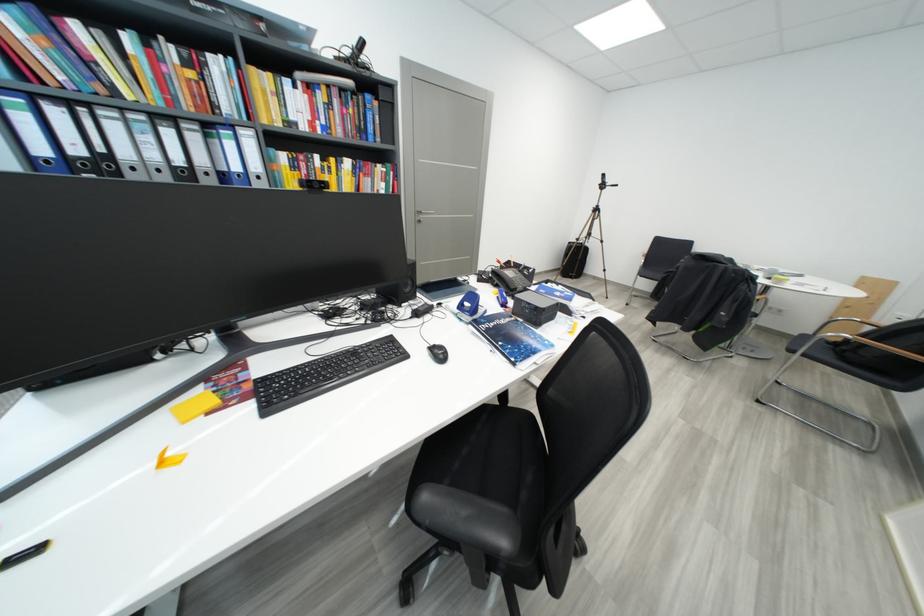
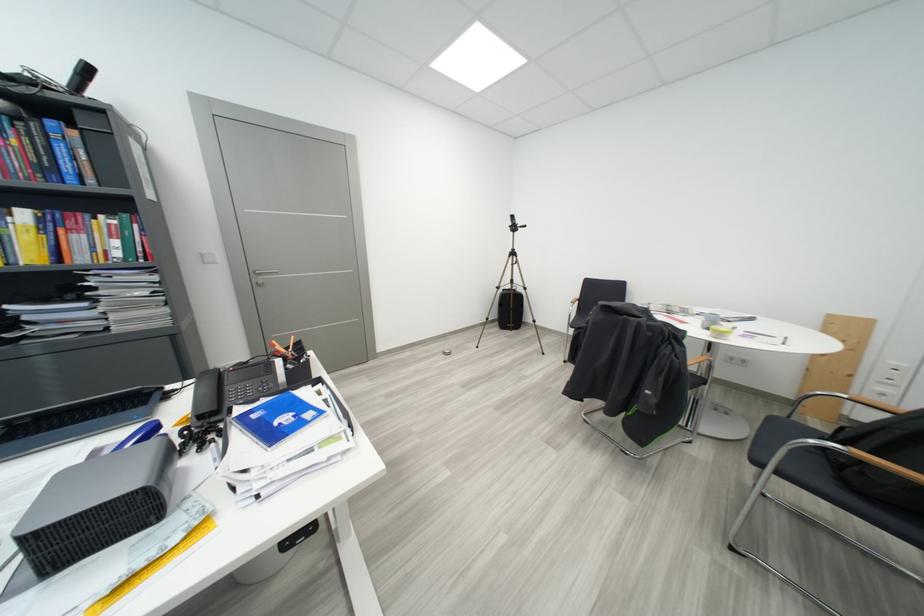
In the second image, find the point that corresponds to the point at 587,243 in the first image.

(506, 291)